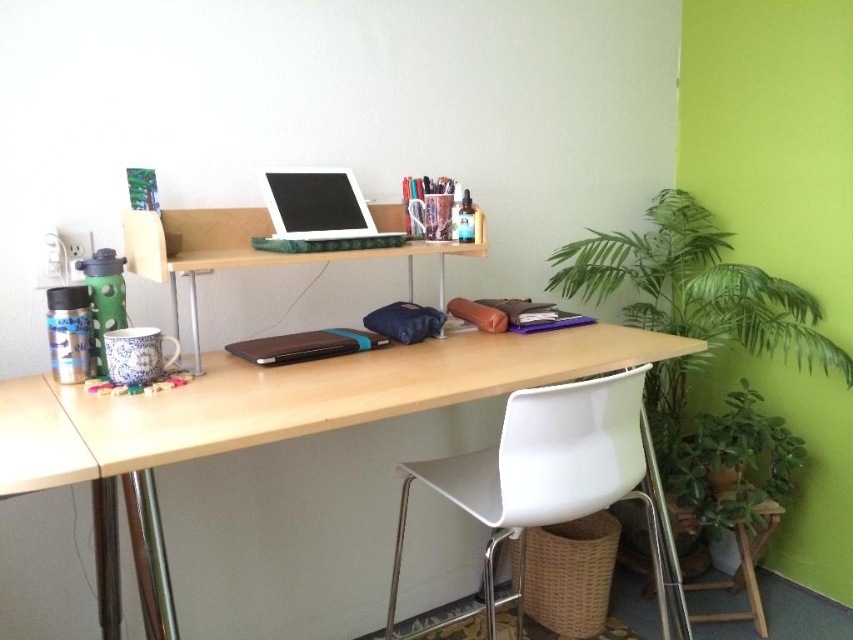
You are standing in front of the desk in the home office. There are two points marked on the desk surface. The first point is at coordinates point (323, 225) and the second is at point (260, 353). If you want to place a small object closer to you without moving the existing items, which point should you choose?

You should choose point (323, 225) because it is closer to you than point (260, 353).

You are standing in front of the desk in the home office scene. There are two points marked on the desk surface at coordinates point (741, 460) and point (283, 349). Which point is closer to you?

Point (283, 349) is closer to you because it is less further to the camera than point (741, 460).

You are setting up a new desk arrangement and want to place a decorative item between the green leafy plant at lower right and the brown leather laptop at center. Considering their sizes, which object should you place closer to the edge of the desk to avoid overcrowding?

The green leafy plant at lower right is bigger than the brown leather laptop at center, so you should place the decorative item closer to the edge near the green leafy plant at lower right to avoid overcrowding.